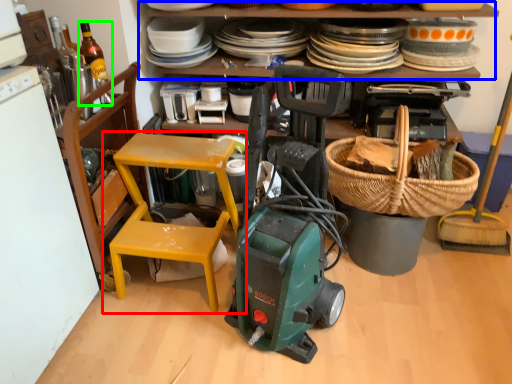
Question: Estimate the real-world distances between objects in this image. Which object is closer to chair (highlighted by a red box), shelf (highlighted by a blue box) or bottle (highlighted by a green box)?

Choices:
 (A) shelf
 (B) bottle

Answer: (B)